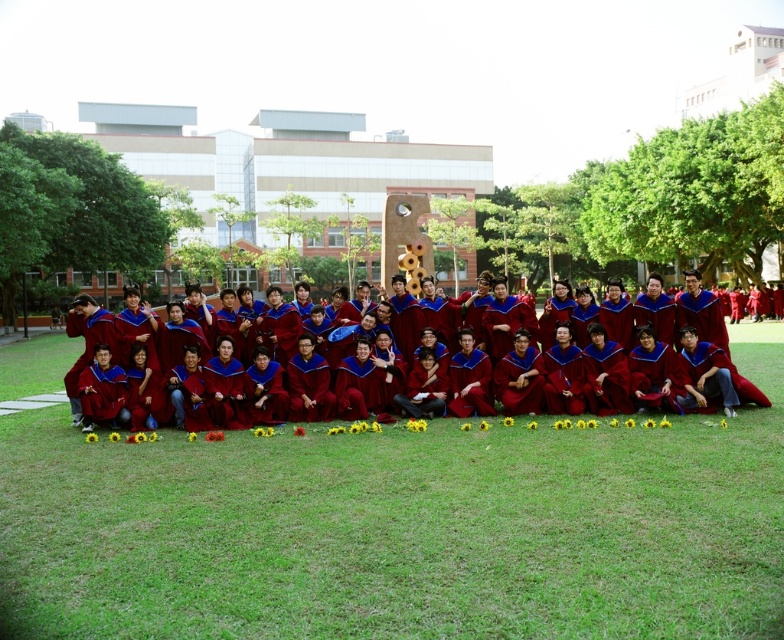
Does green grass at center appear over maroon velvet graduation gowns at center?

No, green grass at center is not above maroon velvet graduation gowns at center.

Is green grass at center further to camera compared to maroon velvet graduation gowns at center?

No.

What do you see at coordinates (401, 528) in the screenshot? I see `green grass at center` at bounding box center [401, 528].

The width and height of the screenshot is (784, 640). Find the location of `green grass at center`. green grass at center is located at coordinates (401, 528).